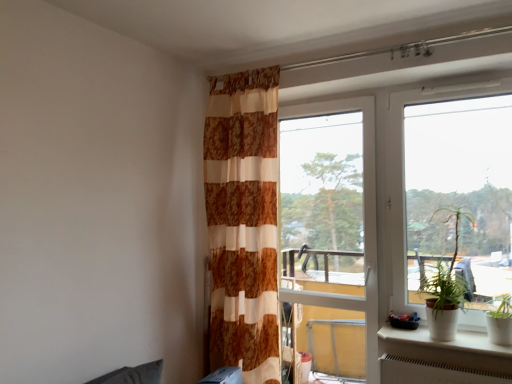
Question: Is white ceramic pot at lower right not near brown textured curtain at center?

Choices:
 (A) no
 (B) yes

Answer: (B)

Question: Considering the relative sizes of white ceramic pot at lower right and brown textured curtain at center in the image provided, is white ceramic pot at lower right bigger than brown textured curtain at center?

Choices:
 (A) yes
 (B) no

Answer: (B)

Question: From a real-world perspective, is white ceramic pot at lower right located higher than brown textured curtain at center?

Choices:
 (A) no
 (B) yes

Answer: (A)

Question: Is white ceramic pot at lower right thinner than brown textured curtain at center?

Choices:
 (A) no
 (B) yes

Answer: (B)

Question: Is white ceramic pot at lower right directly adjacent to brown textured curtain at center?

Choices:
 (A) yes
 (B) no

Answer: (B)

Question: Could you tell me if white ceramic pot at lower right is facing brown textured curtain at center?

Choices:
 (A) yes
 (B) no

Answer: (B)

Question: Can you confirm if green leafy plant at right is smaller than white ceramic pot at lower right?

Choices:
 (A) yes
 (B) no

Answer: (B)

Question: Can you see green leafy plant at right touching white ceramic pot at lower right?

Choices:
 (A) no
 (B) yes

Answer: (A)

Question: Is green leafy plant at right turned away from white ceramic pot at lower right?

Choices:
 (A) no
 (B) yes

Answer: (A)

Question: Does green leafy plant at right have a larger size compared to white ceramic pot at lower right?

Choices:
 (A) no
 (B) yes

Answer: (B)

Question: Does green leafy plant at right turn towards white ceramic pot at lower right?

Choices:
 (A) yes
 (B) no

Answer: (B)

Question: Is green leafy plant at right closer to camera compared to white ceramic pot at lower right?

Choices:
 (A) no
 (B) yes

Answer: (A)

Question: Is transparent glass screen door at center directly adjacent to green leafy plant at right?

Choices:
 (A) no
 (B) yes

Answer: (A)